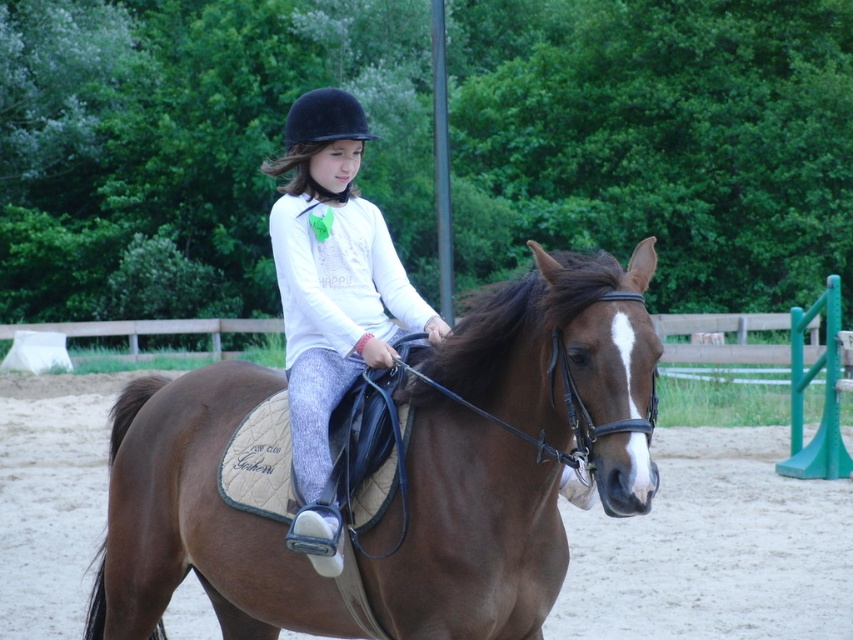
You are an event coordinator at the equestrian arena and need to ensure the rider is positioned correctly. According to the image, is the brown leather saddle at center located to the left or right of the white matte shirt at center?

The brown leather saddle at center is to the right of the white matte shirt at center.